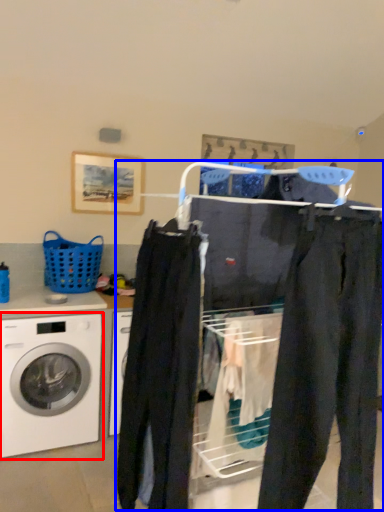
Question: Among these objects, which one is nearest to the camera, washing machine (highlighted by a red box) or closet (highlighted by a blue box)?

Choices:
 (A) washing machine
 (B) closet

Answer: (B)